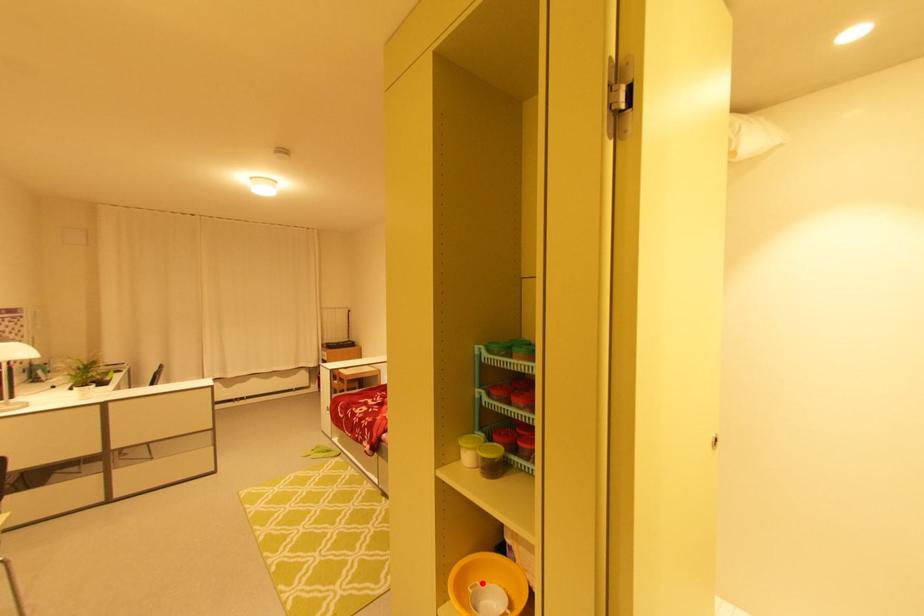
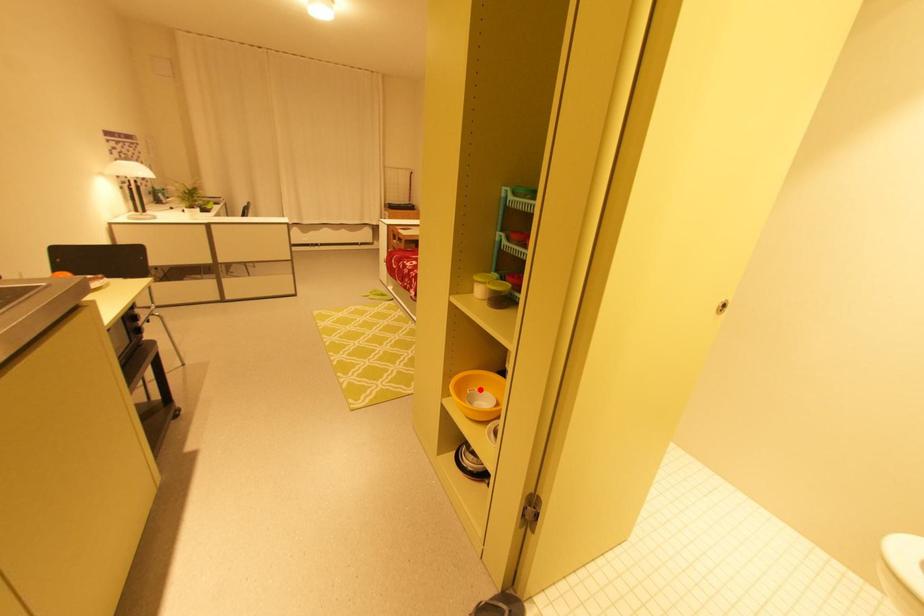
I am providing you with two images of the same scene from different viewpoints. A red point is marked on the first image and another point is marked on the second image. Is the marked point in image1 the same physical position as the marked point in image2?

A: Yes